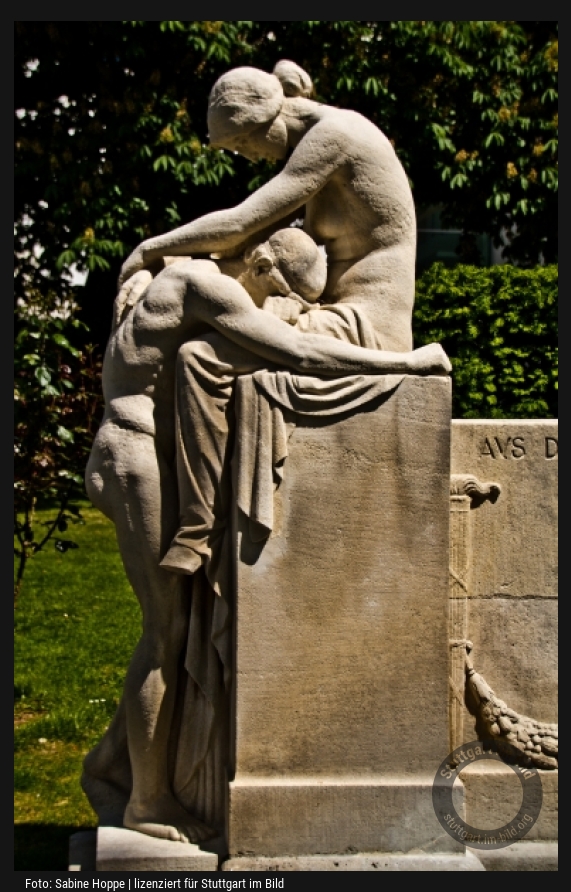
Find the location of a particular element. Image resolution: width=571 pixels, height=892 pixels. statue is located at coordinates (292, 327).